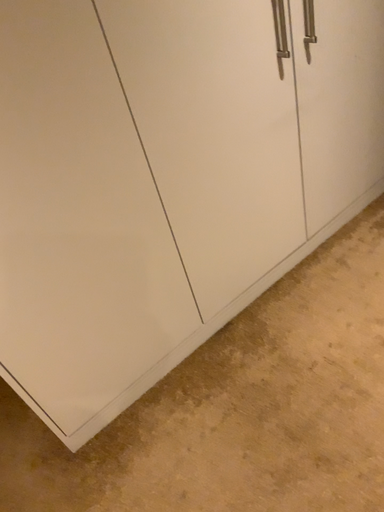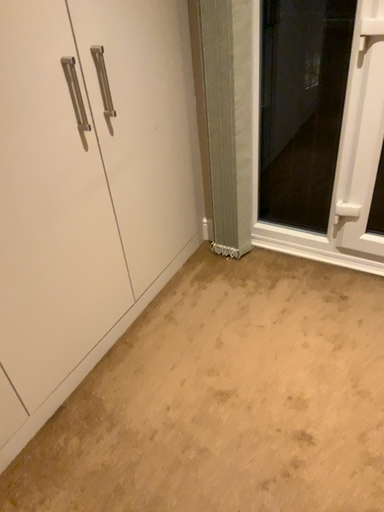
Question: How did the camera likely rotate when shooting the video?

Choices:
 (A) rotated right
 (B) rotated left

Answer: (A)